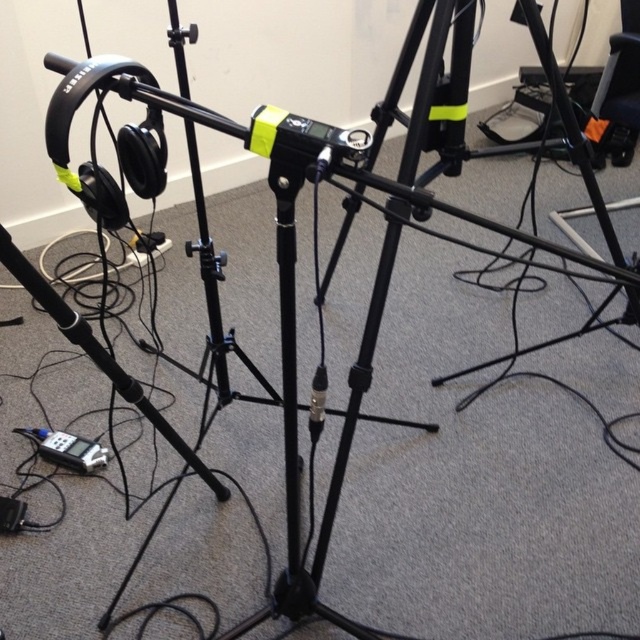
Question: From the image, what is the correct spatial relationship of black matte tripod at center in relation to silver metallic digital device at lower left?

Choices:
 (A) below
 (B) above

Answer: (B)

Question: In this image, where is black matte tripod at center located relative to silver metallic digital device at lower left?

Choices:
 (A) above
 (B) below

Answer: (A)

Question: Among these points, which one is nearest to the camera?

Choices:
 (A) (588, 179)
 (B) (60, 445)

Answer: (A)

Question: Does black matte tripod at center come behind silver metallic digital device at lower left?

Choices:
 (A) yes
 (B) no

Answer: (B)

Question: Among these objects, which one is nearest to the camera?

Choices:
 (A) black matte tripod at center
 (B) silver metallic digital device at lower left

Answer: (A)

Question: Which object is closer to the camera taking this photo?

Choices:
 (A) black matte tripod at center
 (B) silver metallic digital device at lower left

Answer: (A)